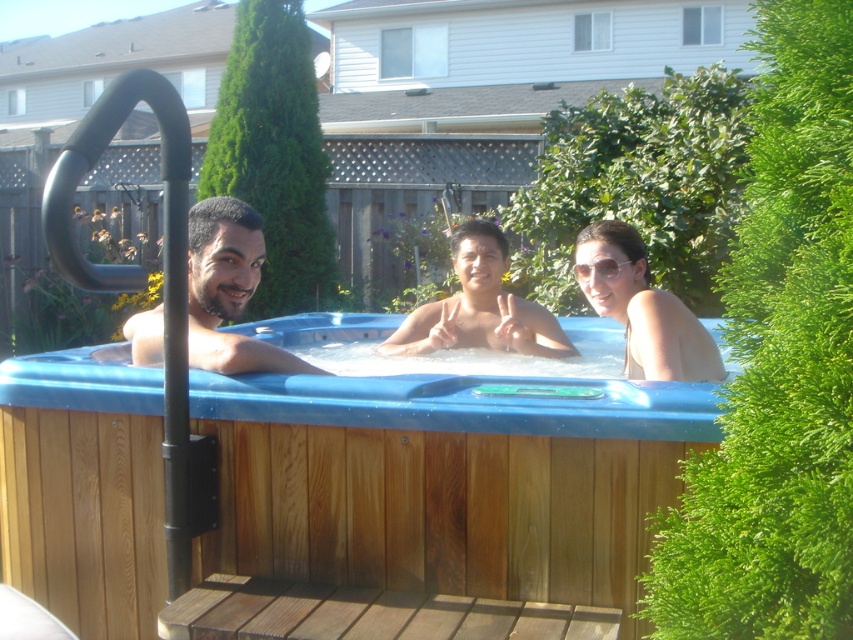
Is brown wooden deck at lower center to the left of matte skin at center from the viewer's perspective?

Indeed, brown wooden deck at lower center is positioned on the left side of matte skin at center.

From the picture: Is brown wooden deck at lower center below matte skin at center?

Yes.

Where is `brown wooden deck at lower center`? The image size is (853, 640). brown wooden deck at lower center is located at coordinates (367, 614).

Does brown wooden deck at lower center appear over matte white bikini at center?

No, brown wooden deck at lower center is not above matte white bikini at center.

Does point (498, 600) lie in front of point (648, 305)?

Yes.

The height and width of the screenshot is (640, 853). In order to click on brown wooden deck at lower center in this screenshot , I will do `click(367, 614)`.

Is the position of brown wooden deck at lower center less distant than that of matte black man at center?

Yes, it is in front of matte black man at center.

Which is more to the left, brown wooden deck at lower center or matte black man at center?

matte black man at center is more to the left.

Is point (281, 605) positioned behind point (192, 344)?

No, (281, 605) is in front of (192, 344).

Image resolution: width=853 pixels, height=640 pixels. I want to click on brown wooden deck at lower center, so click(x=367, y=614).